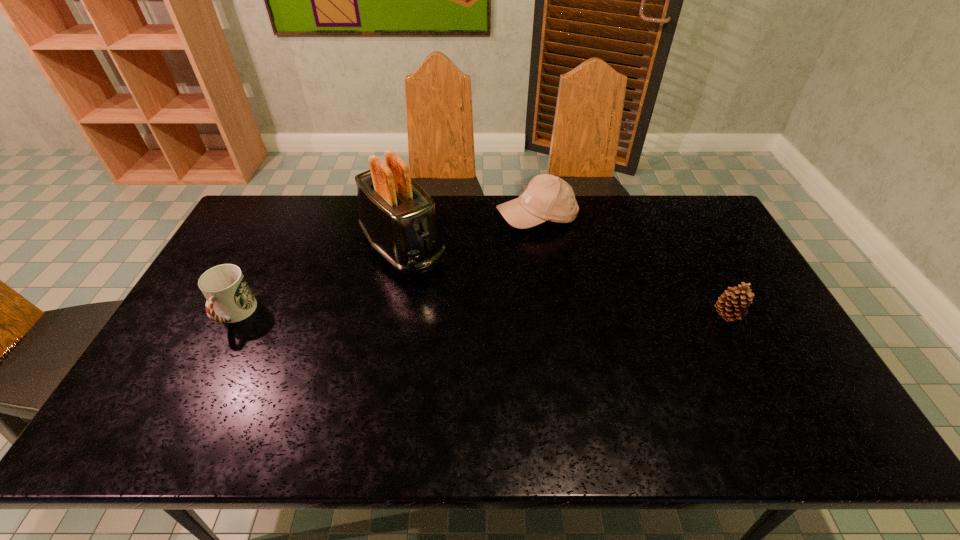
Find the location of a particular element. Image resolution: width=960 pixels, height=540 pixels. vacant region located 0.060m on the side of the third object from right to left with the control lever is located at coordinates (436, 288).

Locate an element on the screen. free space located on the front-facing side of the second object from right to left is located at coordinates 515,305.

This screenshot has width=960, height=540. What are the coordinates of `free location located 0.180m on the front-facing side of the second object from right to left` in the screenshot? It's located at (522, 272).

I want to click on vacant space located on the front-facing side of the second object from right to left, so click(x=514, y=310).

The width and height of the screenshot is (960, 540). Find the location of `toaster present at the far edge`. toaster present at the far edge is located at coordinates (398, 217).

Image resolution: width=960 pixels, height=540 pixels. Find the location of `baseball cap present at the far edge`. baseball cap present at the far edge is located at coordinates (547, 198).

Locate an element on the screen. object at the left edge is located at coordinates point(229,298).

Find the location of a particular element. This screenshot has width=960, height=540. object that is at the right edge is located at coordinates (734, 301).

Find the location of a particular element. This screenshot has height=540, width=960. free space at the far edge of the desktop is located at coordinates (642, 204).

The image size is (960, 540). Find the location of `free location at the near edge`. free location at the near edge is located at coordinates point(228,398).